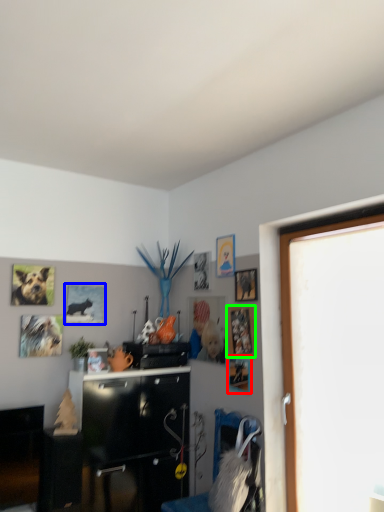
Question: Estimate the real-world distances between objects in this image. Which object is farther from picture frame (highlighted by a red box), picture frame (highlighted by a blue box) or picture frame (highlighted by a green box)?

Choices:
 (A) picture frame
 (B) picture frame

Answer: (A)